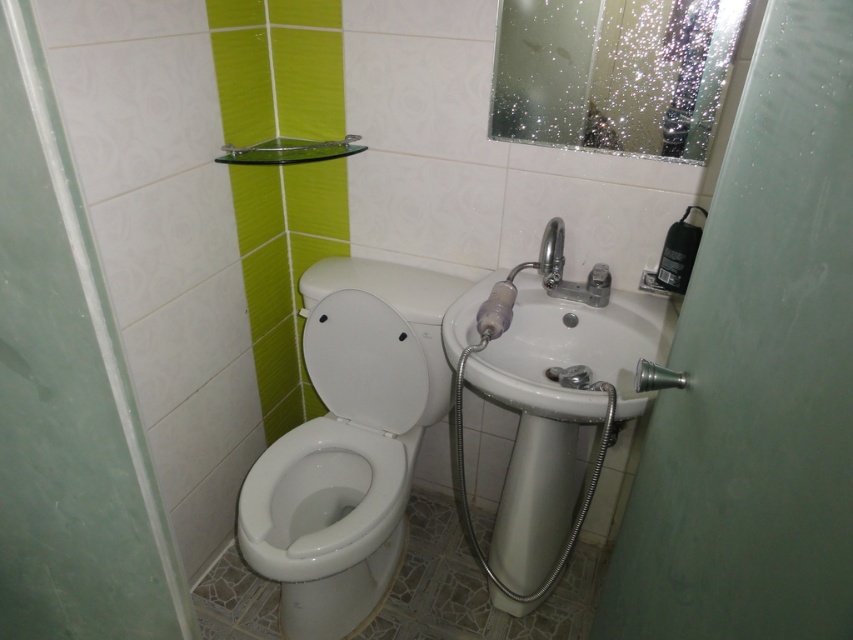
You are standing in the bathroom and see two points marked on the wall. The first point is at coordinate point(412,268) and the second is at point(643,385). Which point is closer to you?

Point(412,268) is further to the camera than point(643,385), so the second point is closer to you.

You are a plumber trying to install a new fixture in the bathroom. You have two options to place between the toilet and the sink. The white glossy bidet at center and the polished chrome faucet at upper right. Which one is taller and should be placed where?

The white glossy bidet at center is taller than the polished chrome faucet at upper right. Since the bidet is taller, it should be placed in a position where its height won